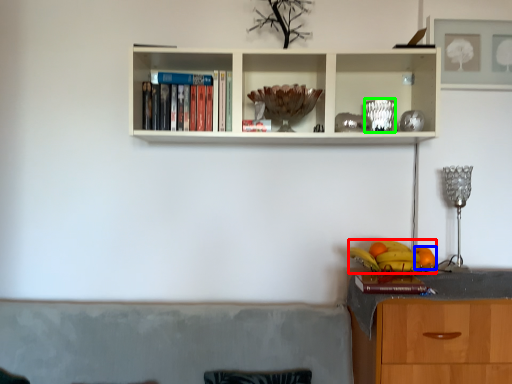
Question: Which object is positioned closest to fruit (highlighted by a red box)? Select from orange (highlighted by a blue box) and glass vase (highlighted by a green box).

Choices:
 (A) orange
 (B) glass vase

Answer: (A)